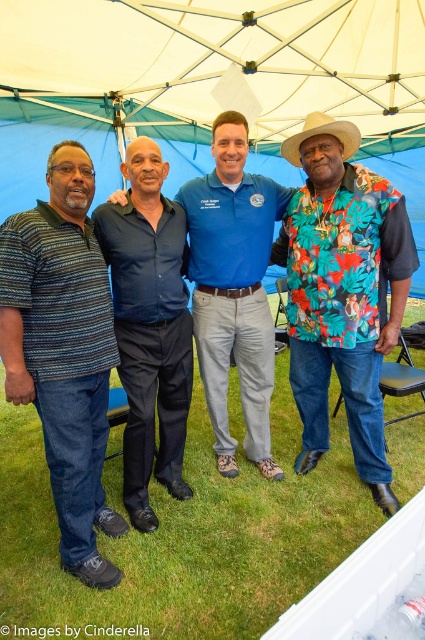
Does point (285, 93) come farther from viewer compared to point (246, 237)?

Yes, it is.

Who is more forward, [121,86] or [203,237]?

Point [203,237] is in front.

This screenshot has width=425, height=640. Describe the element at coordinates (209, 84) in the screenshot. I see `blue fabric canopy at upper center` at that location.

This screenshot has height=640, width=425. What are the coordinates of `blue fabric canopy at upper center` in the screenshot? It's located at (209, 84).

Does blue fabric canopy at upper center have a smaller size compared to floral print shirt at right?

Actually, blue fabric canopy at upper center might be larger than floral print shirt at right.

Does point (71, 51) come closer to viewer compared to point (325, 211)?

No, it is not.

Identify the location of blue fabric canopy at upper center. (209, 84).

In the scene shown: How distant is blue fabric canopy at upper center from striped polo shirt at left?

A distance of 8.00 feet exists between blue fabric canopy at upper center and striped polo shirt at left.

Which is below, blue fabric canopy at upper center or striped polo shirt at left?

Positioned lower is striped polo shirt at left.

Is point (306, 65) behind point (87, 173)?

Yes, it is behind point (87, 173).

The height and width of the screenshot is (640, 425). Find the location of `blue fabric canopy at upper center`. blue fabric canopy at upper center is located at coordinates (209, 84).